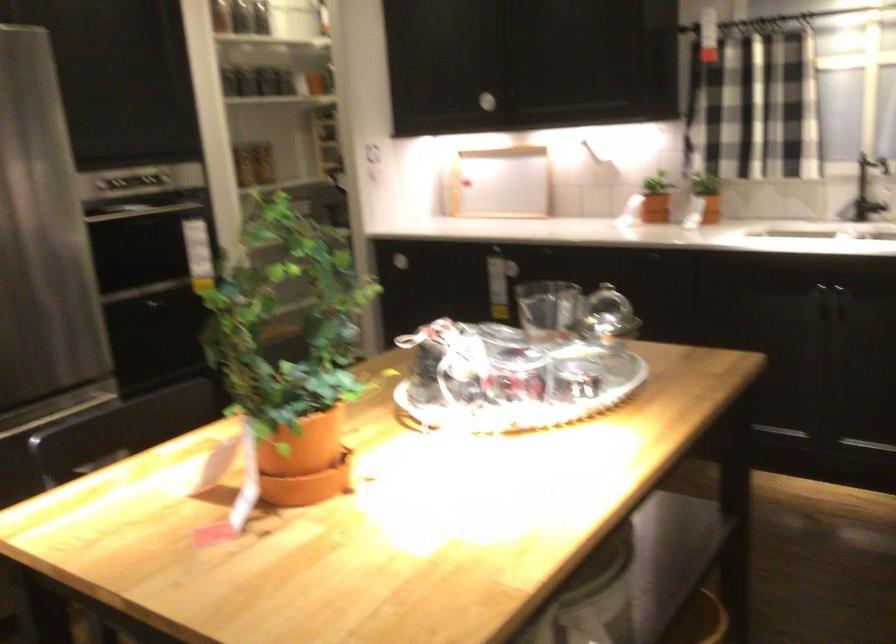
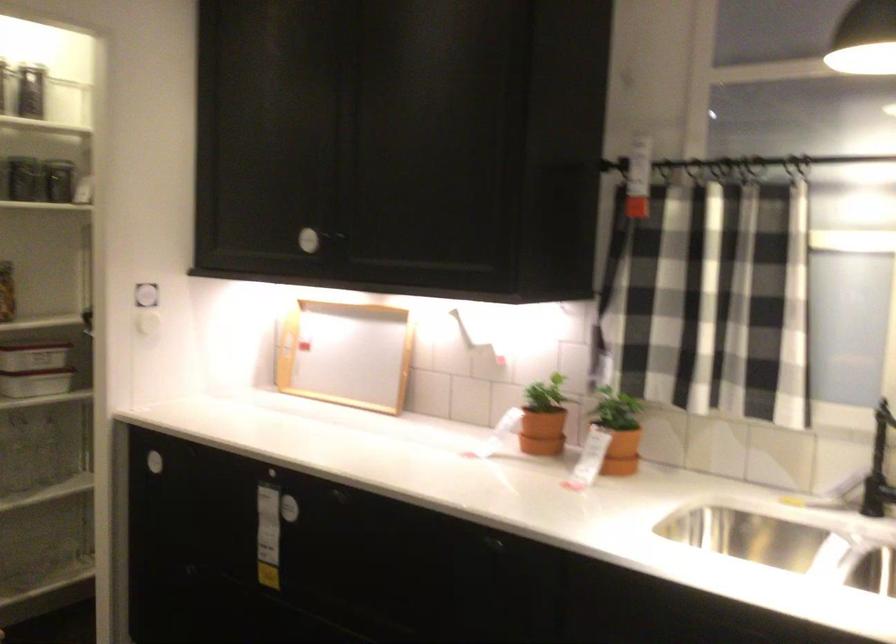
Where in the second image is the point corresponding to the point at 709,190 from the first image?

(617, 430)